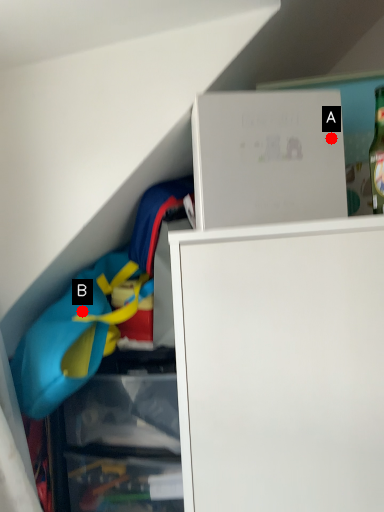
Question: Two points are circled on the image, labeled by A and B beside each circle. Which point is further to the camera?

Choices:
 (A) A is further
 (B) B is further

Answer: (B)